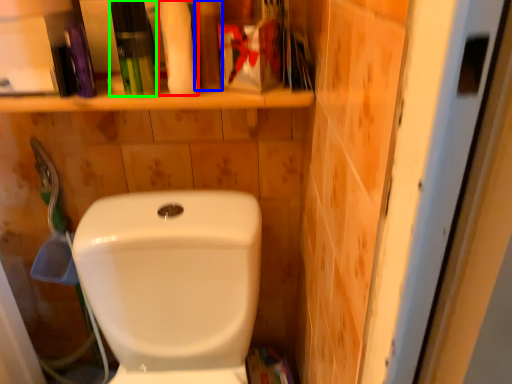
Question: Based on their relative distances, which object is nearer to cleaning product (highlighted by a red box)? Choose from toiletry (highlighted by a blue box) and toiletry (highlighted by a green box).

Choices:
 (A) toiletry
 (B) toiletry

Answer: (A)